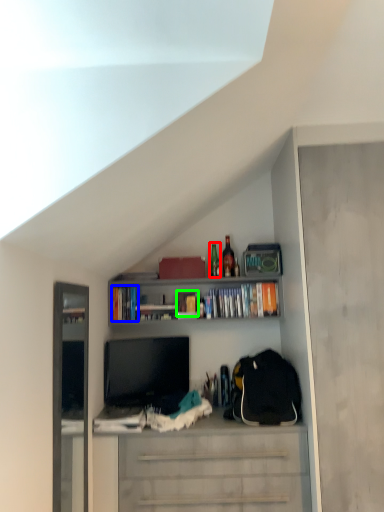
Question: Estimate the real-world distances between objects in this image. Which object is closer to bottle (highlighted by a red box), book (highlighted by a blue box) or book (highlighted by a green box)?

Choices:
 (A) book
 (B) book

Answer: (B)